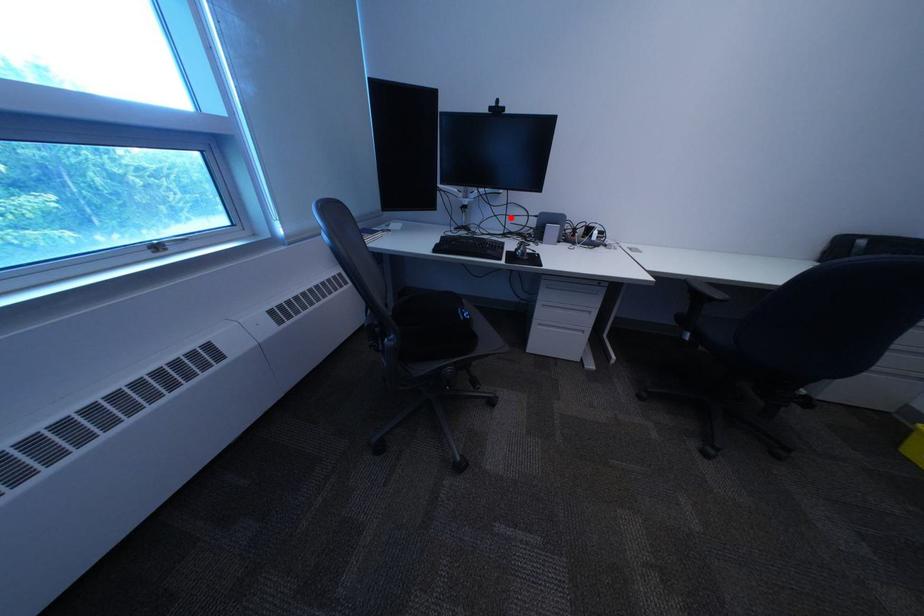
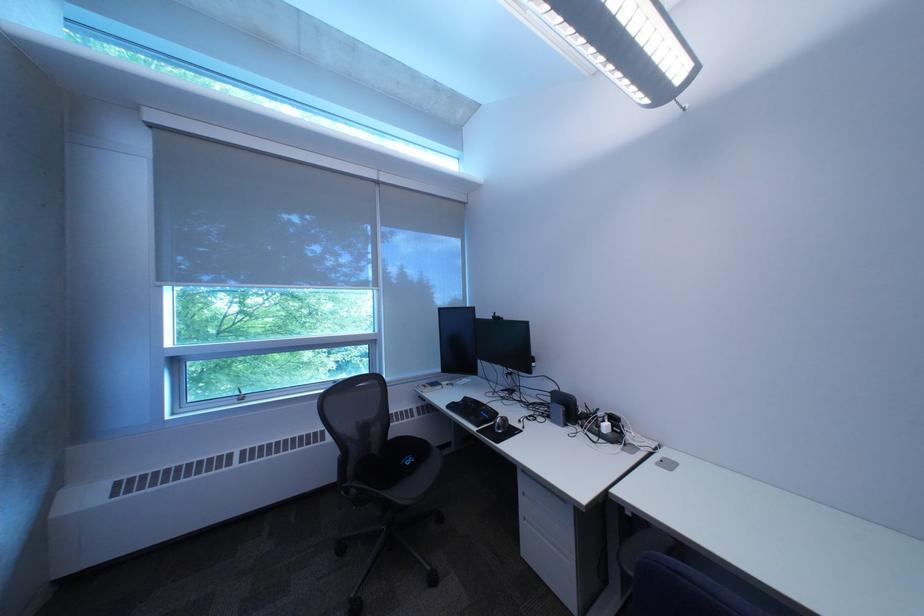
Locate, in the second image, the point that corresponds to the highlighted location in the first image.

(532, 387)